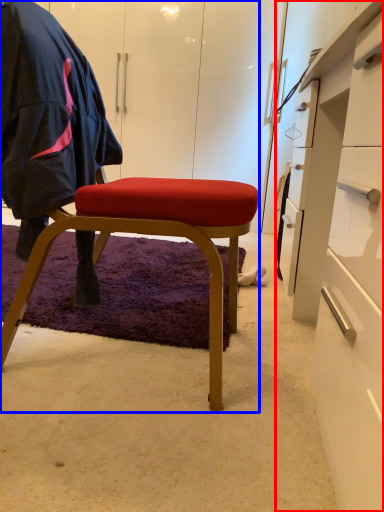
Question: Which point is closer to the camera, desk (highlighted by a red box) or chair (highlighted by a blue box)?

Choices:
 (A) desk
 (B) chair

Answer: (A)